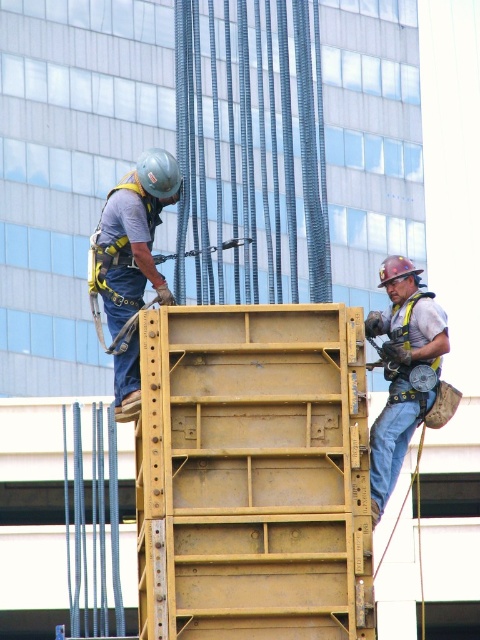
You are a safety inspector reviewing the construction site image. You notice the matte gray helmet at upper left and the matte yellow safety harness at right. Based on their positions, which object is closer to the inspector?

The matte gray helmet at upper left is closer to the inspector because it is in front of the matte yellow safety harness at right, which is positioned behind it.

You are a drone operator trying to capture a photo of the two points on the yellow metal structure. The first point is at coordinates point (348, 432) and the second point is at point (142, 189). Which point should you focus on first if you want to start with the one closer to the camera?

Point (348, 432) is closer to the camera than point (142, 189), so you should focus on point (348, 432) first.

You are a safety inspector checking the construction site. You notice the yellow metallic frame at center and the matte yellow safety harness at right. Which object is larger in size?

The matte yellow safety harness at right is larger than the yellow metallic frame at center.